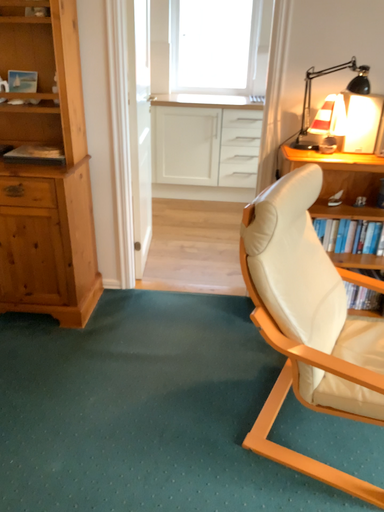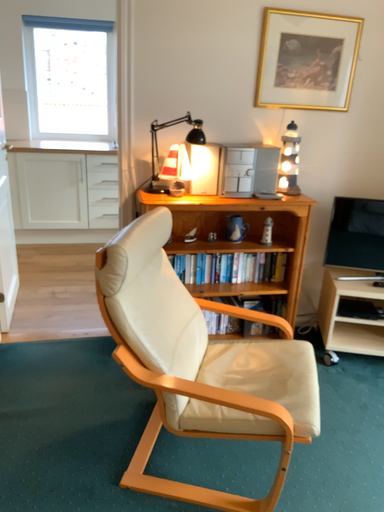
Question: Which way did the camera rotate in the video?

Choices:
 (A) rotated left
 (B) rotated right

Answer: (B)